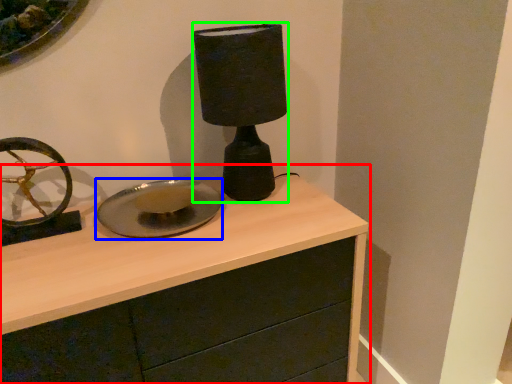
Question: Considering the real-world distances, which object is closest to chest of drawers (highlighted by a red box)? plate (highlighted by a blue box) or table lamp (highlighted by a green box).

Choices:
 (A) plate
 (B) table lamp

Answer: (A)